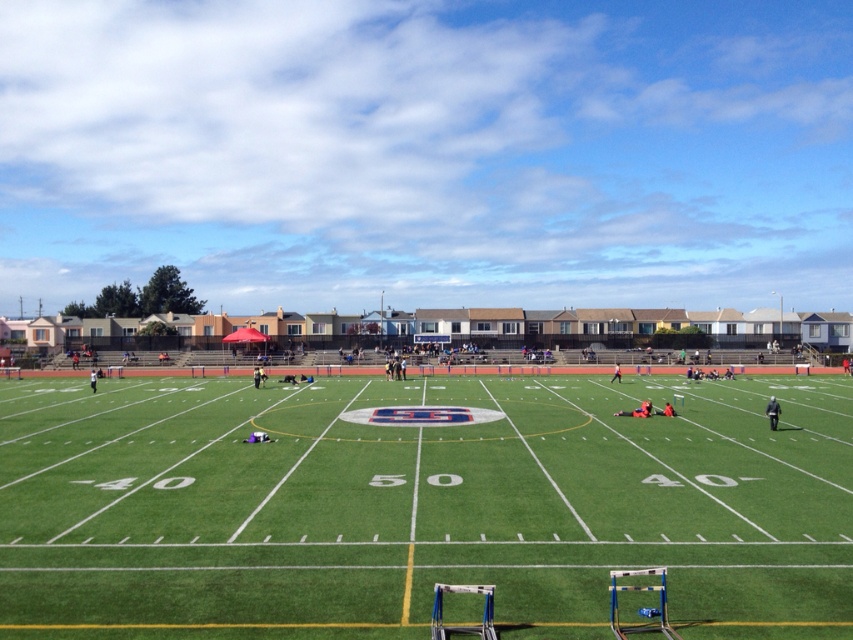
Can you confirm if black fabric person at lower right is positioned to the right of black uniform at center?

Indeed, black fabric person at lower right is positioned on the right side of black uniform at center.

Which of these two, black fabric person at lower right or black uniform at center, stands taller?

black fabric person at lower right

Who is more forward, (770, 401) or (254, 380)?

Point (770, 401) is in front.

This screenshot has height=640, width=853. I want to click on black fabric person at lower right, so click(772, 412).

Locate an element on the screen. red fabric person at center is located at coordinates (637, 410).

Between point (621, 412) and point (666, 404), which one is positioned in front?

Point (621, 412) is more forward.

The height and width of the screenshot is (640, 853). Find the location of `red fabric person at center`. red fabric person at center is located at coordinates (637, 410).

What do you see at coordinates (637, 410) in the screenshot? I see `red fabric person at center` at bounding box center [637, 410].

Between point (646, 410) and point (618, 372), which one is positioned behind?

Point (618, 372)

Who is more forward, (618, 413) or (611, 378)?

Point (618, 413) is in front.

Where is `red fabric person at center`? red fabric person at center is located at coordinates (637, 410).